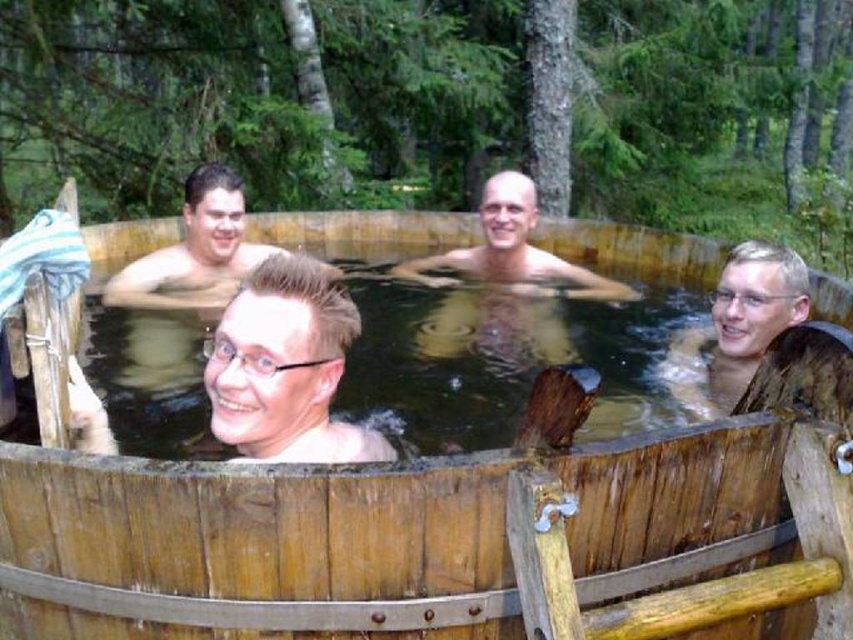
You are a photographer trying to capture a closeup of the clear plastic glasses at center and the smooth skin at right. Given that your camera can only focus on one object at a time, which object should you choose to ensure it fills more of the frame?

The smooth skin at right occupies more space than the clear plastic glasses at center, so you should choose the smooth skin at right to ensure it fills more of the frame.

You are standing at the edge of the wooden hot tub at center in the image. You want to place a floating candle exactly at the point marked as point (254,548). Can you confirm if this point is located on the wooden hot tub at center?

Yes, the point (254,548) is on the wooden hot tub at center, so placing the floating candle there would be appropriate.

You are a photographer trying to capture a closeup of the clear plastic glasses at center and the matte skin at center in the hot tub scene. Which object should you zoom in on more to ensure both are in focus?

The clear plastic glasses at center is smaller than matte skin at center, so you should zoom in more on the clear plastic glasses at center to ensure both are in focus.